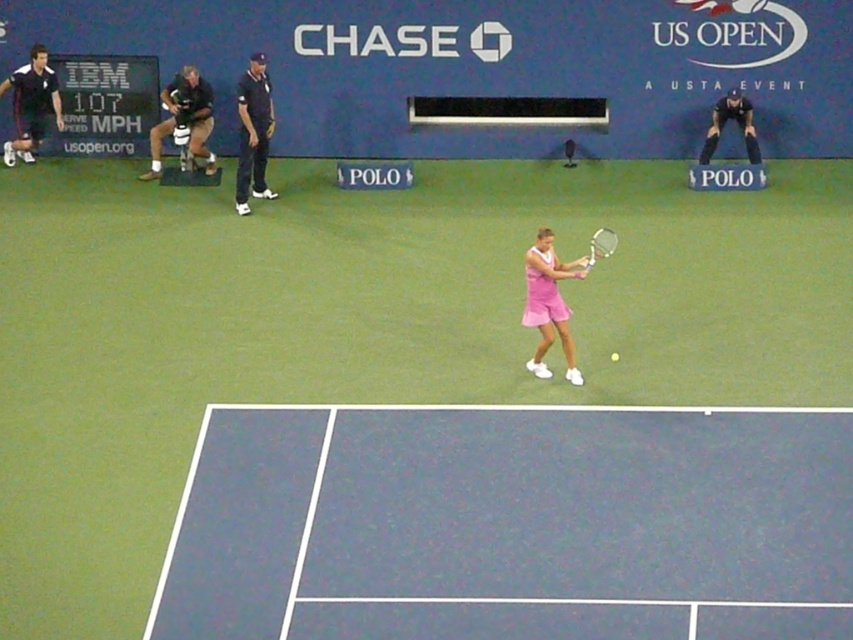
Measure the distance between pink fabric tennis outfit at center and camera.

pink fabric tennis outfit at center is 10.39 meters from camera.

In the scene shown: Who is positioned more to the left, pink fabric tennis outfit at center or white plastic tennis racket at center?

From the viewer's perspective, pink fabric tennis outfit at center appears more on the left side.

Is point (531, 266) closer to camera compared to point (595, 248)?

Yes.

Locate an element on the screen. This screenshot has width=853, height=640. pink fabric tennis outfit at center is located at coordinates (549, 304).

From the picture: Does blue rubber tennis court at center appear on the right side of pink fabric tennis outfit at center?

Incorrect, blue rubber tennis court at center is not on the right side of pink fabric tennis outfit at center.

Does blue rubber tennis court at center have a greater height compared to pink fabric tennis outfit at center?

In fact, blue rubber tennis court at center may be shorter than pink fabric tennis outfit at center.

Measure the distance between blue rubber tennis court at center and camera.

blue rubber tennis court at center is 7.92 meters from camera.

Image resolution: width=853 pixels, height=640 pixels. Find the location of `blue rubber tennis court at center`. blue rubber tennis court at center is located at coordinates (512, 524).

Is blue rubber tennis court at center positioned in front of white plastic tennis racket at center?

Yes, it is.

How distant is blue rubber tennis court at center from white plastic tennis racket at center?

The distance of blue rubber tennis court at center from white plastic tennis racket at center is 4.05 meters.

In order to click on blue rubber tennis court at center in this screenshot , I will do `click(512, 524)`.